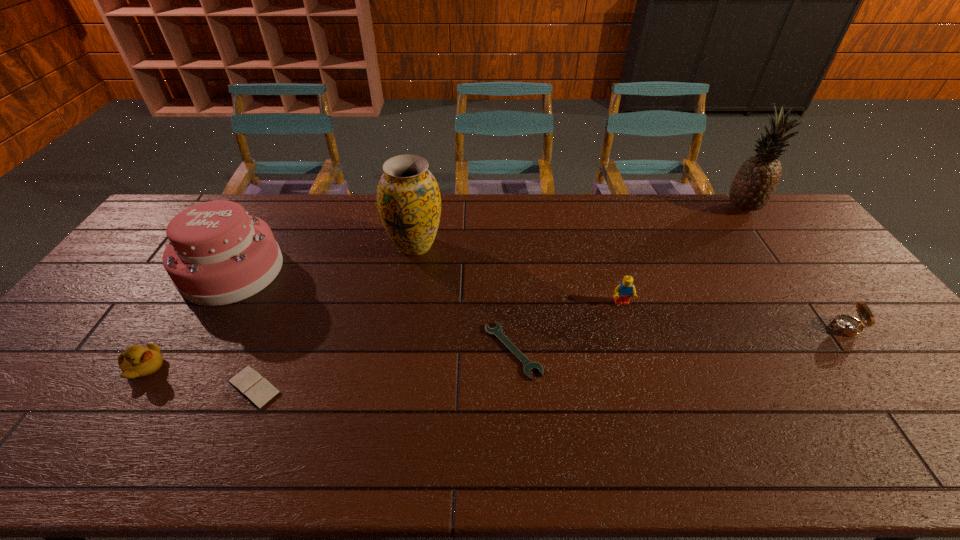
The width and height of the screenshot is (960, 540). I want to click on object that is the sixth closest to the Lego, so click(x=217, y=254).